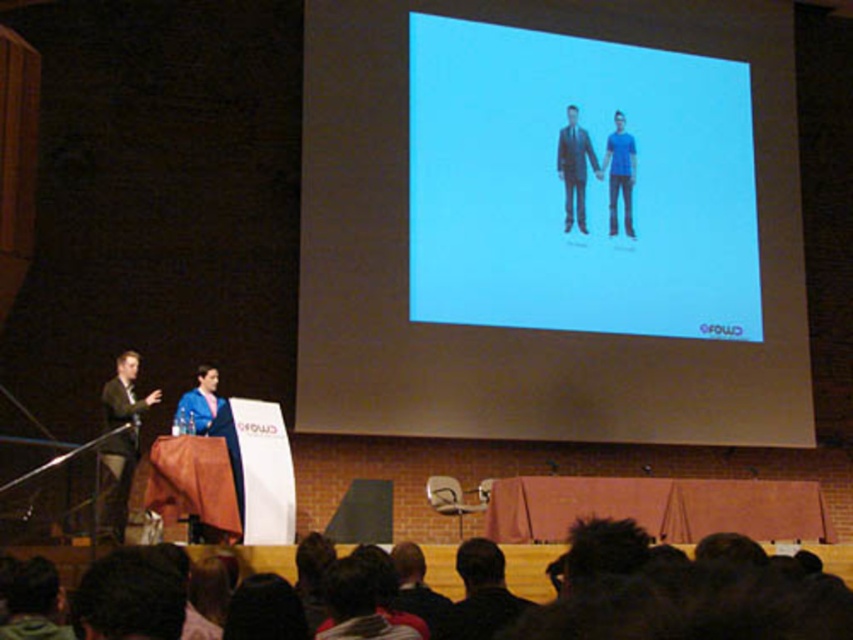
Between blue matte projection screen at upper center and matte black suit at center, which one appears on the right side from the viewer's perspective?

Positioned to the right is blue matte projection screen at upper center.

Identify the location of blue matte projection screen at upper center. point(577,184).

This screenshot has height=640, width=853. Describe the element at coordinates (577, 184) in the screenshot. I see `blue matte projection screen at upper center` at that location.

Does blue matte projection screen at upper center have a greater height compared to matte black suit at left?

Indeed, blue matte projection screen at upper center has a greater height compared to matte black suit at left.

I want to click on blue matte projection screen at upper center, so click(x=577, y=184).

Can you confirm if matte black suit at left is positioned above matte black suit at center?

No, matte black suit at left is not above matte black suit at center.

Locate an element on the screen. The image size is (853, 640). matte black suit at left is located at coordinates (119, 445).